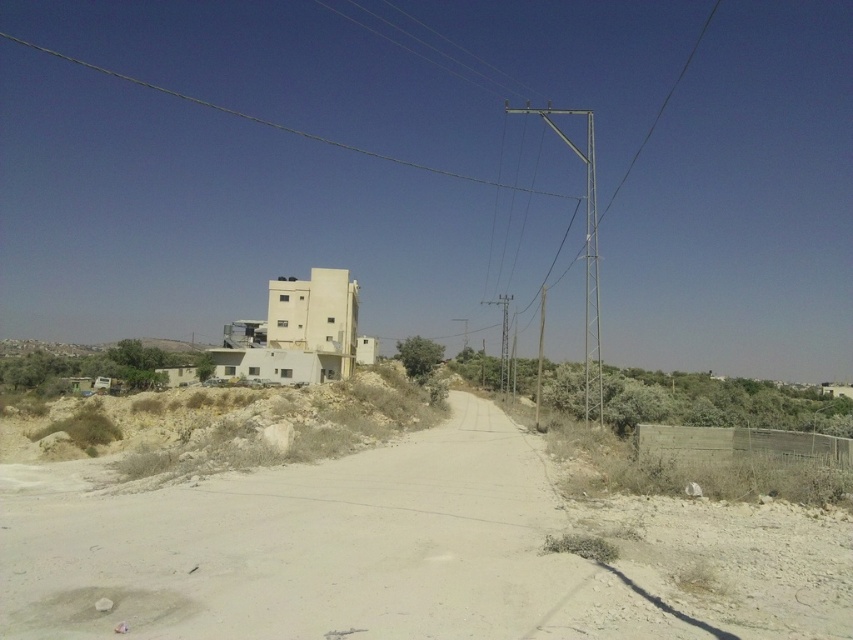
Question: Can you confirm if dusty sand road at center is positioned above silver metallic pole at center-right?

Choices:
 (A) no
 (B) yes

Answer: (A)

Question: Where is dusty sand road at center located in relation to silver metallic pole at center-right in the image?

Choices:
 (A) above
 (B) below

Answer: (B)

Question: Is dusty sand road at center positioned before silver metallic pole at center-right?

Choices:
 (A) no
 (B) yes

Answer: (B)